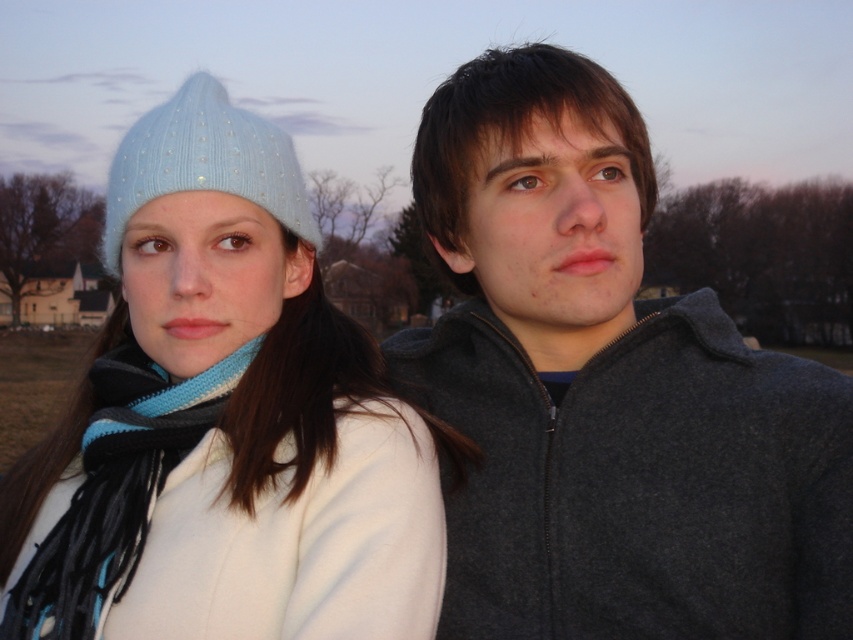
You are a photographer trying to capture a closeup of the charcoal fleece jacket at center. You have a camera with a zoom lens that can focus on objects within a 0.5 unit radius. Given that the point at coordinate (607, 388) is on the charcoal fleece jacket at center, will your camera be able to focus on this jacket?

The point at coordinate (607, 388) is on the charcoal fleece jacket at center, so if the camera can focus within a 0.5 unit radius, it depends on the distance from the camera to the jacket. However, since the exact distance isn

You are a photographer trying to capture a photo of both the charcoal fleece jacket at center and the blue knitted scarf at left. Since you want to ensure both are in focus, which object should you focus on first to account for their depth positions?

You should focus on the charcoal fleece jacket at center first because it is closer to you than the blue knitted scarf at left, ensuring both are in focus when using depth of field.